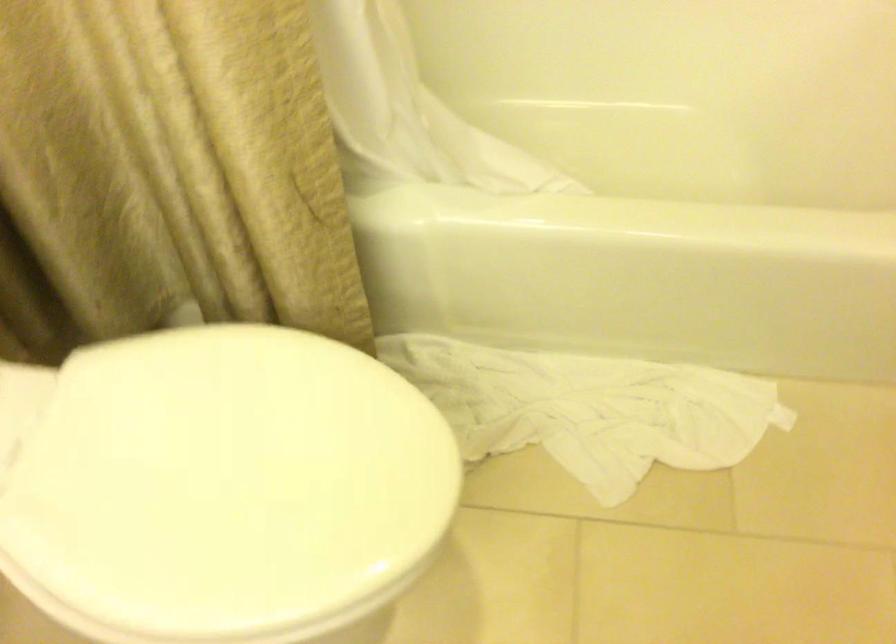
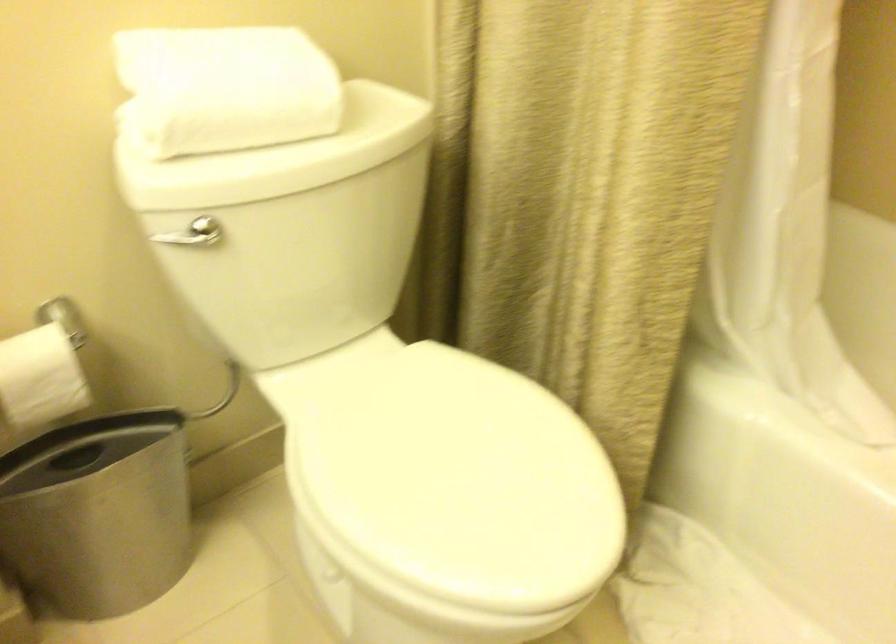
Locate, in the second image, the point that corresponds to point (234, 498) in the first image.

(442, 485)